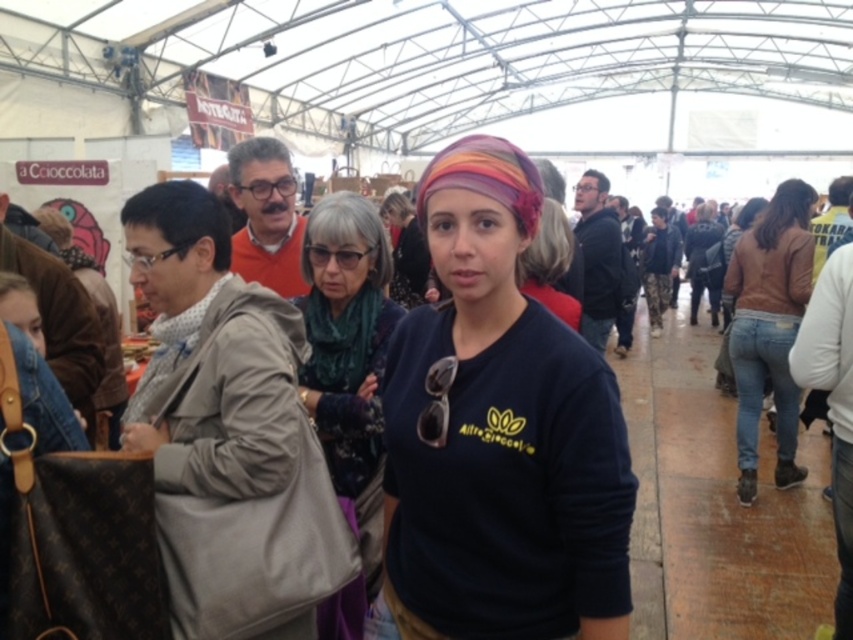
Is point (358, 433) positioned after point (767, 224)?

No.

Which is behind, point (376, 513) or point (781, 397)?

The point (781, 397) is behind.

The width and height of the screenshot is (853, 640). Find the location of `dark green textured scarf at center`. dark green textured scarf at center is located at coordinates tap(347, 353).

Which is more to the left, dark blue jersey at center or dark green textured scarf at center?

dark green textured scarf at center is more to the left.

Which is behind, point (479, 632) or point (328, 428)?

The point (328, 428) is more distant.

I want to click on dark blue jersey at center, so pos(498,433).

Can you confirm if dark blue jersey at center is wider than brown denim jeans at right?

Yes.

Does dark blue jersey at center appear on the right side of brown denim jeans at right?

Incorrect, dark blue jersey at center is not on the right side of brown denim jeans at right.

Between point (531, 308) and point (792, 230), which one is positioned in front?

Positioned in front is point (531, 308).

The image size is (853, 640). I want to click on dark blue jersey at center, so pyautogui.click(x=498, y=433).